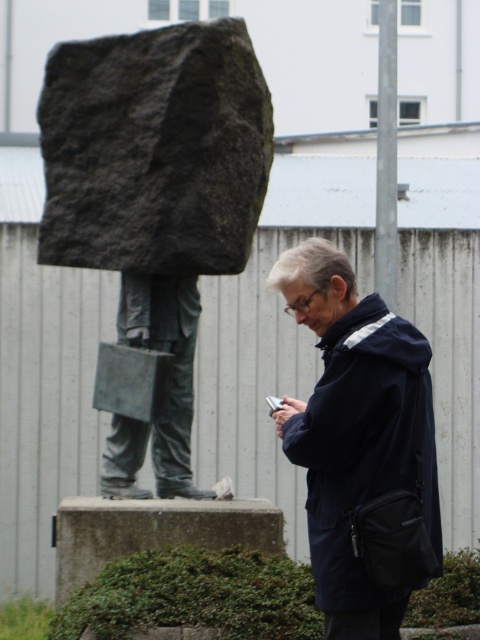
Question: Is dark gray stone statue at center positioned before bronze statue at center?

Choices:
 (A) no
 (B) yes

Answer: (B)

Question: Which point is farther from the camera taking this photo?

Choices:
 (A) (175, 429)
 (B) (218, 531)

Answer: (A)

Question: Does navy blue jacket at center appear over gray concrete boulder at lower center?

Choices:
 (A) no
 (B) yes

Answer: (B)

Question: Which of the following is the farthest from the observer?

Choices:
 (A) navy blue jacket at center
 (B) bronze statue at center

Answer: (B)

Question: Is dark gray stone statue at center bigger than gray concrete boulder at lower center?

Choices:
 (A) no
 (B) yes

Answer: (B)

Question: Among these objects, which one is farthest from the camera?

Choices:
 (A) navy blue jacket at center
 (B) gray concrete boulder at lower center
 (C) bronze statue at center

Answer: (C)